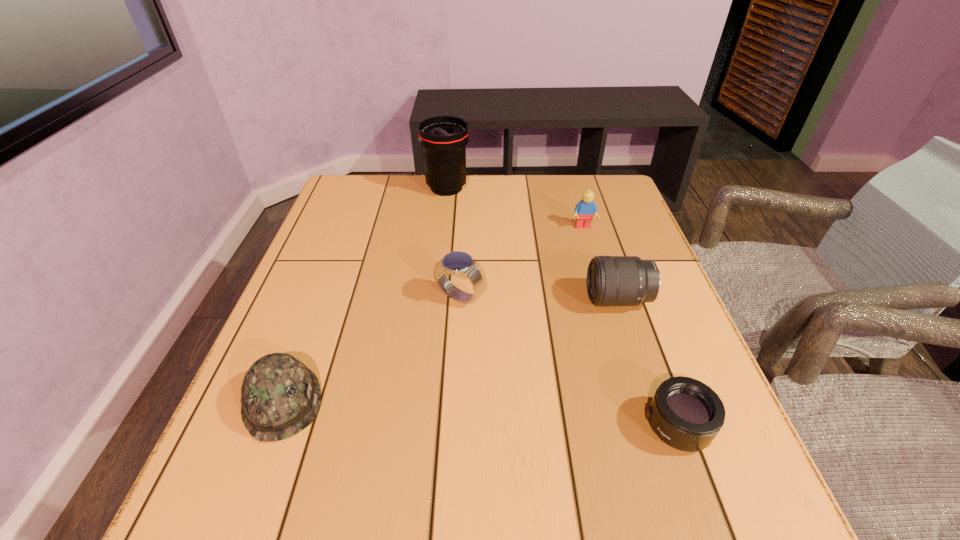
The width and height of the screenshot is (960, 540). Find the location of `vacant space located 0.240m on the face of the Lego`. vacant space located 0.240m on the face of the Lego is located at coordinates (603, 294).

Where is `vacant space located on the surface of the second nearest telephoto lens`? This screenshot has width=960, height=540. vacant space located on the surface of the second nearest telephoto lens is located at coordinates (442, 299).

Locate an element on the screen. This screenshot has height=540, width=960. vacant space located on the surface of the second nearest telephoto lens is located at coordinates (564, 299).

Find the location of a particular element. This screenshot has width=960, height=540. free space located on the surface of the second nearest telephoto lens is located at coordinates (465, 299).

The image size is (960, 540). Find the location of `free space located 0.250m on the back of the watch`. free space located 0.250m on the back of the watch is located at coordinates (463, 220).

The image size is (960, 540). Identify the location of free location located on the right of the headwear. coord(350,401).

The height and width of the screenshot is (540, 960). I want to click on free region located 0.330m on the side of the shortest object with brand markings and control switches, so 449,426.

The image size is (960, 540). I want to click on vacant region located 0.220m on the side of the shortest object with brand markings and control switches, so click(515, 426).

The width and height of the screenshot is (960, 540). In order to click on free space located on the side of the shortest object with brand markings and control switches in this screenshot , I will do `click(449, 426)`.

Identify the location of object that is at the far edge. (444, 138).